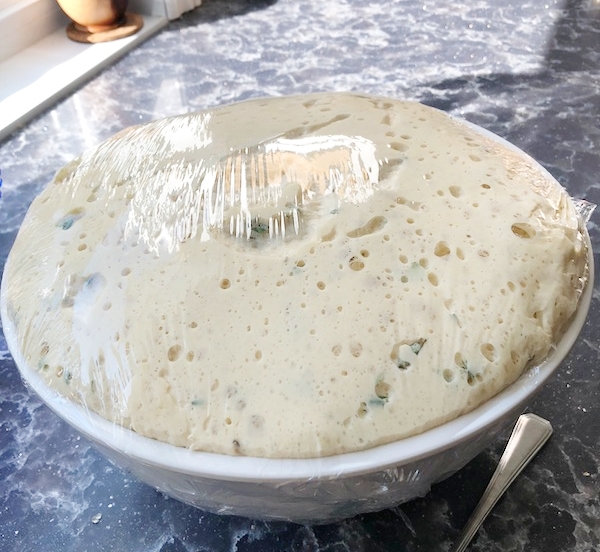
Where is `bowl`? bowl is located at coordinates (432, 450).